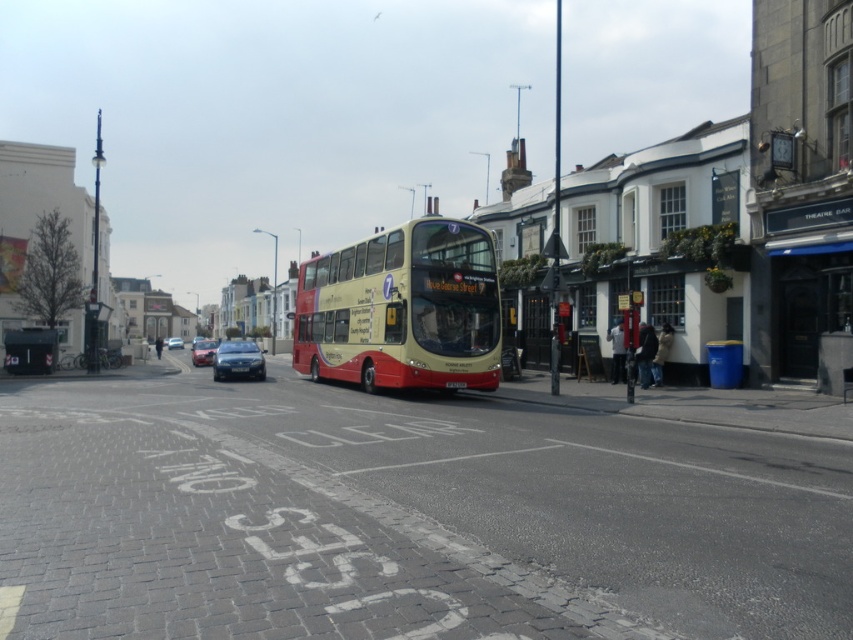
Can you confirm if yellow matte/decorative bus at center is positioned below shiny silver sedan at center?

No, yellow matte/decorative bus at center is not below shiny silver sedan at center.

Is point (473, 282) positioned before point (225, 342)?

Yes.

Which is in front, point (350, 244) or point (231, 349)?

Point (350, 244) is more forward.

In order to click on yellow matte/decorative bus at center in this screenshot , I will do `click(402, 308)`.

Is yellow matte/decorative bus at center above shiny black sedan at center?

Yes, yellow matte/decorative bus at center is above shiny black sedan at center.

Can you confirm if yellow matte/decorative bus at center is positioned to the right of shiny black sedan at center?

Yes, yellow matte/decorative bus at center is to the right of shiny black sedan at center.

This screenshot has width=853, height=640. I want to click on yellow matte/decorative bus at center, so click(x=402, y=308).

The width and height of the screenshot is (853, 640). I want to click on yellow matte/decorative bus at center, so click(402, 308).

Which is more to the right, shiny silver sedan at center or shiny black sedan at center?

From the viewer's perspective, shiny silver sedan at center appears more on the right side.

The width and height of the screenshot is (853, 640). I want to click on shiny silver sedan at center, so click(x=238, y=360).

Which is behind, point (239, 364) or point (196, 356)?

The point (196, 356) is more distant.

This screenshot has width=853, height=640. Identify the location of shiny silver sedan at center. (238, 360).